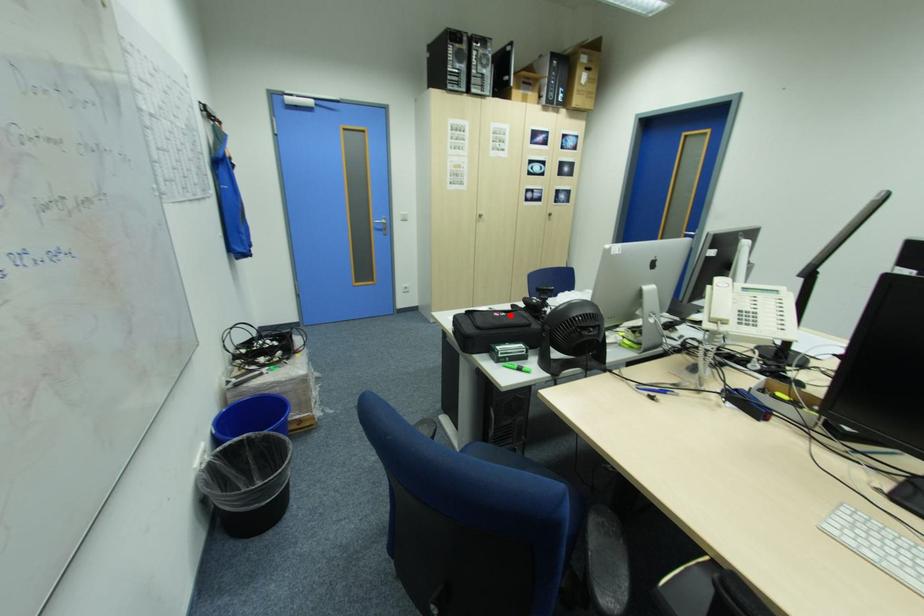
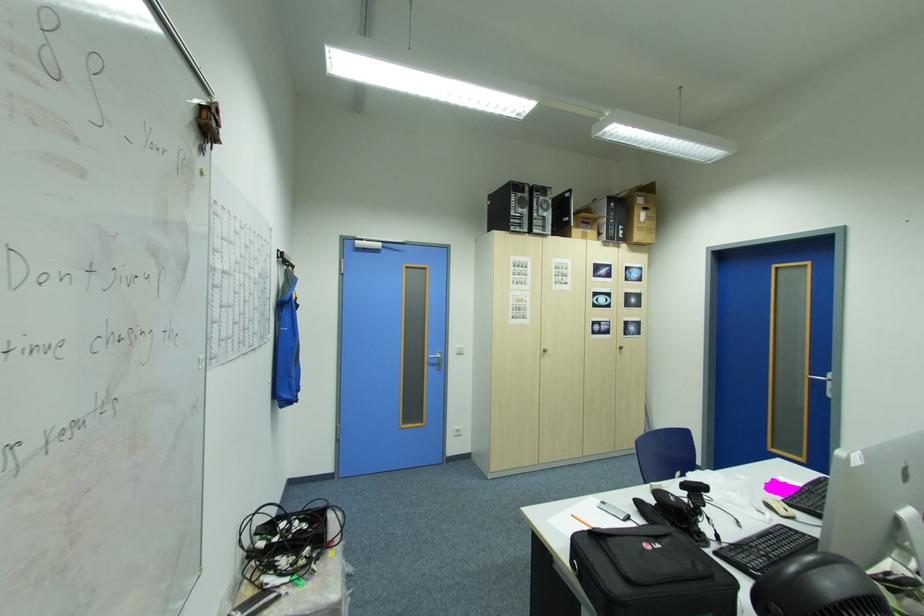
In the second image, find the point that corresponds to the highlighted location in the first image.

(665, 546)